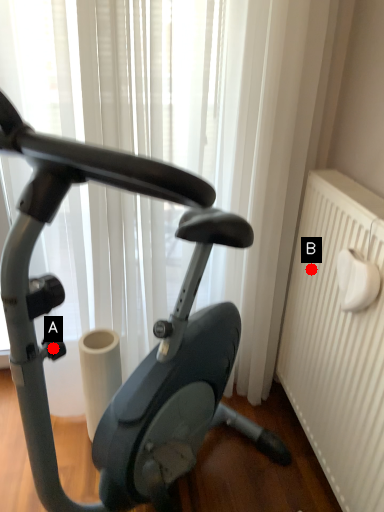
Question: Two points are circled on the image, labeled by A and B beside each circle. Which point appears closest to the camera in this image?

Choices:
 (A) A is closer
 (B) B is closer

Answer: (A)